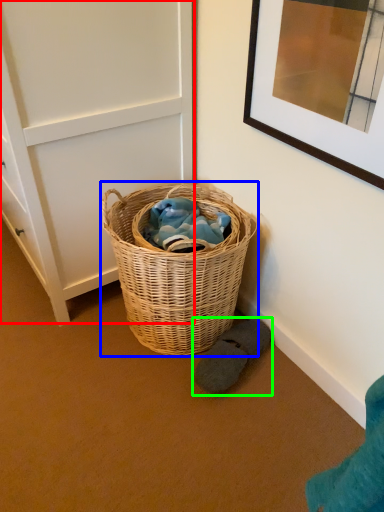
Question: Estimate the real-world distances between objects in this image. Which object is closer to door (highlighted by a red box), picnic basket (highlighted by a blue box) or footwear (highlighted by a green box)?

Choices:
 (A) picnic basket
 (B) footwear

Answer: (A)